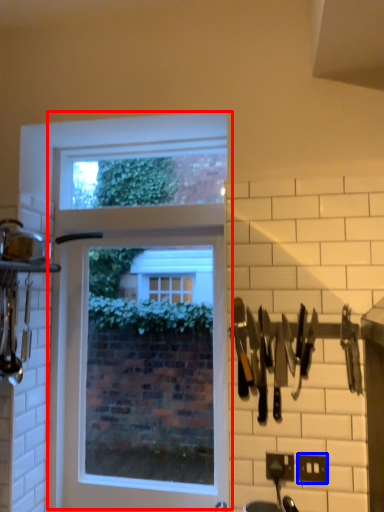
Question: Which point is further to the camera, window (highlighted by a red box) or electric outlet (highlighted by a blue box)?

Choices:
 (A) window
 (B) electric outlet

Answer: (A)